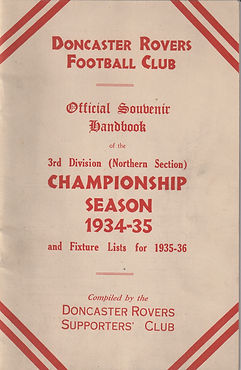
You are a GUI agent. You are given a task and a screenshot of the screen. Output one action in this format:
    pyautogui.click(x=<x>, y=<y>)
    Task: Click on the binder/spine
    
    Given the screenshot: What is the action you would take?
    pyautogui.click(x=4, y=123), pyautogui.click(x=2, y=267)